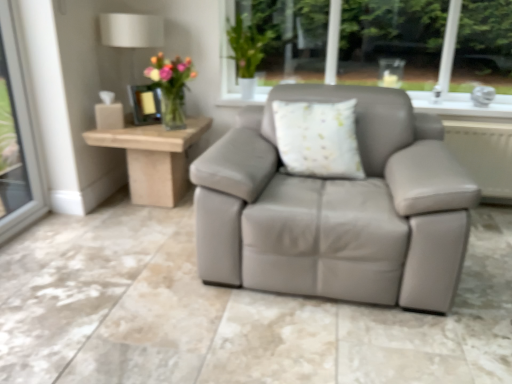
The image size is (512, 384). What do you see at coordinates (170, 87) in the screenshot? I see `translucent glass vase at upper left` at bounding box center [170, 87].

Measure the distance between green matte vase at upper center and camera.

green matte vase at upper center and camera are 9.17 feet apart.

What do you see at coordinates (131, 30) in the screenshot? I see `metallic lampshade at upper left` at bounding box center [131, 30].

The height and width of the screenshot is (384, 512). Identify the location of light wood/roughobject at left. (154, 158).

Would you say green matte vase at upper center is outside translucent glass vase at upper left?

Yes, green matte vase at upper center is not within translucent glass vase at upper left.

In terms of width, does green matte vase at upper center look wider or thinner when compared to translucent glass vase at upper left?

green matte vase at upper center is thinner than translucent glass vase at upper left.

Which object is closer to the camera, green matte vase at upper center or translucent glass vase at upper left?

translucent glass vase at upper left is in front.

Measure the distance between metallic lampshade at upper left and translucent glass vase at upper left.

11.89 inches.

Does metallic lampshade at upper left have a larger size compared to translucent glass vase at upper left?

Correct, metallic lampshade at upper left is larger in size than translucent glass vase at upper left.

From a real-world perspective, is metallic lampshade at upper left above or below translucent glass vase at upper left?

metallic lampshade at upper left is situated higher than translucent glass vase at upper left in the real world.

You are a GUI agent. You are given a task and a screenshot of the screen. Output one action in this format:
    pyautogui.click(x=<x>, y=<y>)
    Task: Click on the lamp located on the left of translucent glass vase at upper left
    This screenshot has height=384, width=512.
    Given the screenshot: What is the action you would take?
    pyautogui.click(x=131, y=30)

Can you tell me how much metallic lampshade at upper left and light wood/roughobject at left differ in facing direction?

There is a 0.00296-degree angle between the facing directions of metallic lampshade at upper left and light wood/roughobject at left.

Between point (162, 23) and point (131, 129), which one is positioned in front?

The point (131, 129) is closer.

Image resolution: width=512 pixels, height=384 pixels. I want to click on lamp that is above the light wood/roughobject at left (from the image's perspective), so click(131, 30).

Can metallic lampshade at upper left be found inside green matte vase at upper center?

Actually, metallic lampshade at upper left is outside green matte vase at upper center.

From a real-world perspective, is green matte vase at upper center over metallic lampshade at upper left?

Yes, from a real-world perspective, green matte vase at upper center is on top of metallic lampshade at upper left.

In the scene shown: Does green matte vase at upper center have a greater width compared to metallic lampshade at upper left?

In fact, green matte vase at upper center might be narrower than metallic lampshade at upper left.

Consider the image. Can you confirm if green matte vase at upper center is shorter than metallic lampshade at upper left?

Yes.

You are a GUI agent. You are given a task and a screenshot of the screen. Output one action in this format:
    pyautogui.click(x=<x>, y=<y>)
    Task: Click on the plant above the metallic lampshade at upper left (from the image's perspective)
    The height and width of the screenshot is (384, 512).
    Given the screenshot: What is the action you would take?
    pyautogui.click(x=249, y=41)

Could you tell me if metallic lampshade at upper left is facing green matte vase at upper center?

No, metallic lampshade at upper left is not turned towards green matte vase at upper center.

Can we say metallic lampshade at upper left lies outside green matte vase at upper center?

metallic lampshade at upper left is positioned outside green matte vase at upper center.

Is metallic lampshade at upper left touching green matte vase at upper center?

No, metallic lampshade at upper left is not with green matte vase at upper center.

Which is correct: light wood/roughobject at left is inside green matte vase at upper center, or outside of it?

light wood/roughobject at left is not inside green matte vase at upper center, it's outside.

You are a GUI agent. You are given a task and a screenshot of the screen. Output one action in this format:
    pyautogui.click(x=<x>, y=<y>)
    Task: Click on the plant located on the right of light wood/roughobject at left
    
    Given the screenshot: What is the action you would take?
    pyautogui.click(x=249, y=41)

Who is taller, light wood/roughobject at left or green matte vase at upper center?

Standing taller between the two is green matte vase at upper center.

From a real-world perspective, is light wood/roughobject at left beneath green matte vase at upper center?

Yes, from a real-world perspective, light wood/roughobject at left is below green matte vase at upper center.

Is light wood/roughobject at left at the left side of metallic lampshade at upper left?

No, light wood/roughobject at left is not to the left of metallic lampshade at upper left.

How many degrees apart are the facing directions of light wood/roughobject at left and metallic lampshade at upper left?

There is a 0.00296-degree angle between the facing directions of light wood/roughobject at left and metallic lampshade at upper left.

How much distance is there between light wood/roughobject at left and metallic lampshade at upper left?

The distance of light wood/roughobject at left from metallic lampshade at upper left is 26.52 inches.

From a real-world perspective, is light wood/roughobject at left above or below metallic lampshade at upper left?

Clearly, from a real-world perspective, light wood/roughobject at left is below metallic lampshade at upper left.

The image size is (512, 384). Find the location of `floral arrangement in front of the green matte vase at upper center`. floral arrangement in front of the green matte vase at upper center is located at coordinates (170, 87).

Identify the location of lamp on the left of translucent glass vase at upper left. (131, 30).

Estimate the real-world distances between objects in this image. Which object is closer to metallic lampshade at upper left, translucent glass vase at upper left or light wood/roughobject at left?

translucent glass vase at upper left is closer to metallic lampshade at upper left.

Considering their positions, is green matte vase at upper center positioned closer to light wood/roughobject at left than metallic lampshade at upper left?

metallic lampshade at upper left is closer to light wood/roughobject at left.

Estimate the real-world distances between objects in this image. Which object is closer to light wood/roughobject at left, green matte vase at upper center or translucent glass vase at upper left?

Result: translucent glass vase at upper left lies closer to light wood/roughobject at left than the other object.

Based on their spatial positions, is translucent glass vase at upper left or green matte vase at upper center further from light wood/roughobject at left?

green matte vase at upper center is further to light wood/roughobject at left.

Based on their spatial positions, is green matte vase at upper center or light wood/roughobject at left closer to translucent glass vase at upper left?

light wood/roughobject at left is positioned closer to the anchor translucent glass vase at upper left.

Which object lies nearer to the anchor point light wood/roughobject at left, metallic lampshade at upper left or translucent glass vase at upper left?

translucent glass vase at upper left.

When comparing their distances from green matte vase at upper center, does translucent glass vase at upper left or metallic lampshade at upper left seem further?

metallic lampshade at upper left.

Based on their spatial positions, is translucent glass vase at upper left or green matte vase at upper center further from metallic lampshade at upper left?

green matte vase at upper center.

This screenshot has width=512, height=384. I want to click on floral arrangement between green matte vase at upper center and light wood/roughobject at left vertically, so click(x=170, y=87).

Locate an element on the screen. The width and height of the screenshot is (512, 384). floral arrangement between metallic lampshade at upper left and green matte vase at upper center in the horizontal direction is located at coordinates (170, 87).

Where is `floral arrangement between metallic lampshade at upper left and light wood/roughobject at left in the vertical direction`? The height and width of the screenshot is (384, 512). floral arrangement between metallic lampshade at upper left and light wood/roughobject at left in the vertical direction is located at coordinates (170, 87).

At what (x,y) coordinates should I click in order to perform the action: click on lamp that lies between green matte vase at upper center and light wood/roughobject at left from top to bottom. Please return your answer as a coordinate pair (x, y). The image size is (512, 384). Looking at the image, I should click on (131, 30).